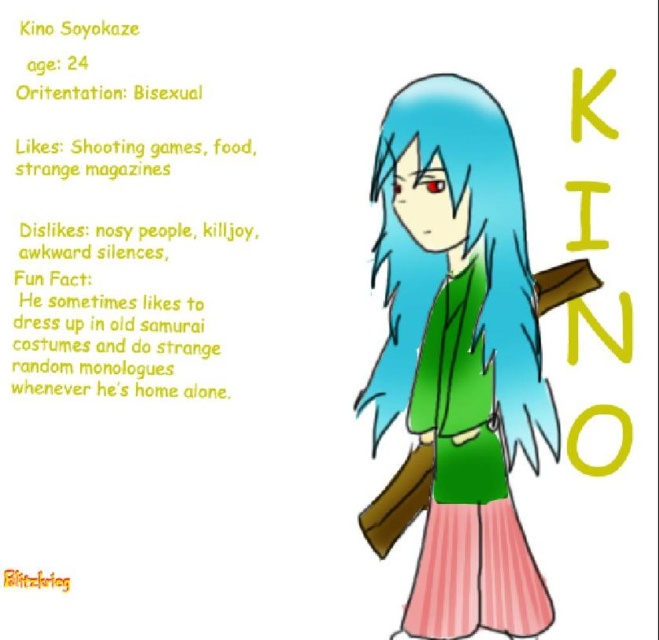
Can you confirm if matte green dress at center is positioned to the left of brushed metal blitzkrieg at lower left?

In fact, matte green dress at center is to the right of brushed metal blitzkrieg at lower left.

Is matte green dress at center positioned behind brushed metal blitzkrieg at lower left?

No, it is not.

The height and width of the screenshot is (640, 659). What do you see at coordinates (461, 353) in the screenshot?
I see `matte green dress at center` at bounding box center [461, 353].

Image resolution: width=659 pixels, height=640 pixels. What are the coordinates of `matte green dress at center` in the screenshot? It's located at (461, 353).

Is the position of matte green dress at center more distant than that of green fabric jacket at center?

No, matte green dress at center is in front of green fabric jacket at center.

Who is more forward, (x=397, y=138) or (x=148, y=150)?

Positioned in front is point (x=397, y=138).

Consider the image. Who is more distant from viewer, (525,246) or (43,176)?

Point (43,176)

The width and height of the screenshot is (659, 640). I want to click on matte green dress at center, so (461, 353).

Is green fabric jacket at center smaller than brushed metal blitzkrieg at lower left?

Actually, green fabric jacket at center might be larger than brushed metal blitzkrieg at lower left.

Between green fabric jacket at center and brushed metal blitzkrieg at lower left, which one has less height?

With less height is brushed metal blitzkrieg at lower left.

Is point (115, 150) farther from viewer compared to point (51, 572)?

Yes.

Find the location of a particular element. green fabric jacket at center is located at coordinates (132, 156).